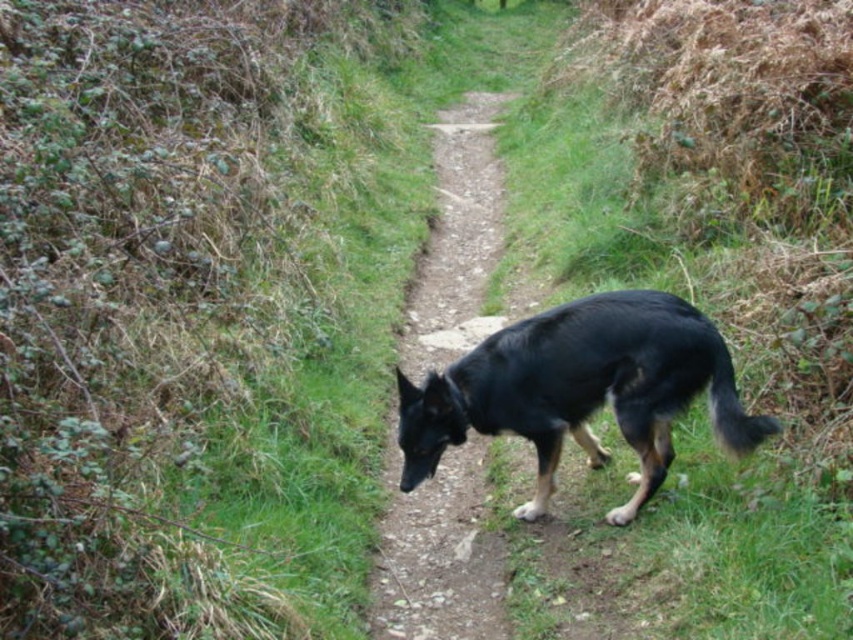
Is point (602, 392) more distant than point (402, 596)?

No, (602, 392) is in front of (402, 596).

Who is more forward, (602, 394) or (421, 502)?

Point (602, 394)

Locate an element on the screen. This screenshot has height=640, width=853. black glossy dog at center is located at coordinates (581, 390).